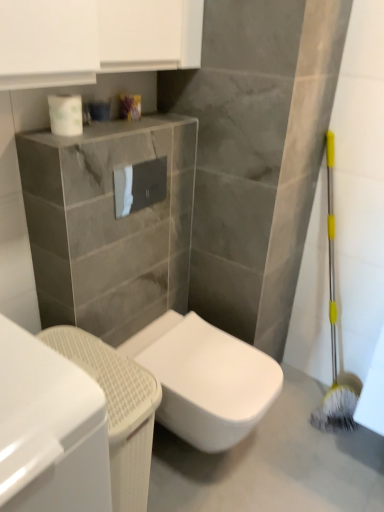
Question: Looking at their shapes, would you say white glossy cabinet at lower left is wider or thinner than white glossy toilet at center?

Choices:
 (A) thin
 (B) wide

Answer: (B)

Question: From a real-world perspective, is white glossy cabinet at lower left physically located above or below white glossy toilet at center?

Choices:
 (A) below
 (B) above

Answer: (B)

Question: Which object is positioned closest to the white glossy toilet at center?

Choices:
 (A) white glossy toilet paper at upper center, acting as the second toilet paper starting from the back
 (B) white glossy cabinet at lower left
 (C) white glossy toilet paper at center, which is the second toilet paper in left-to-right order
 (D) white glossy toilet at lower left
 (E) white glossy toilet at center

Answer: (E)

Question: Based on their relative distances, which object is farther from the white glossy toilet at center?

Choices:
 (A) white glossy toilet at center
 (B) white glossy cabinet at lower left
 (C) white glossy toilet paper at upper center, placed as the 2th toilet paper when sorted from right to left
 (D) white glossy toilet paper at center, the first toilet paper from the back
 (E) white glossy toilet at lower left

Answer: (C)